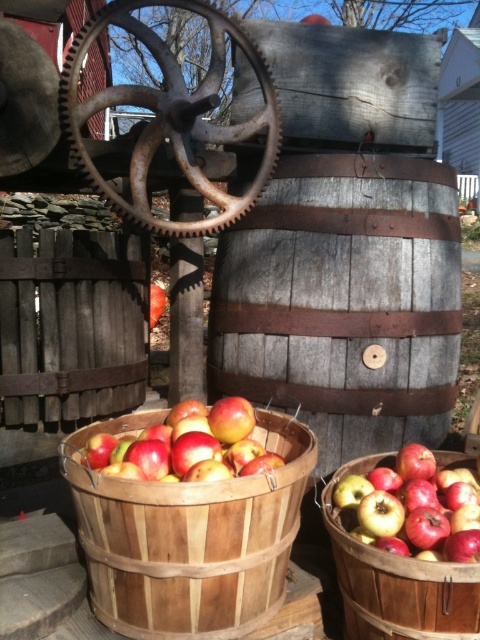
Locate an element on the screen. shiny red apples at lower right is located at coordinates (415, 508).

Who is lower down, shiny red apples at lower right or shiny red apples at center?

shiny red apples at lower right is below.

What do you see at coordinates (415, 508) in the screenshot? This screenshot has height=640, width=480. I see `shiny red apples at lower right` at bounding box center [415, 508].

Find the location of `shiny red apples at lower right`. shiny red apples at lower right is located at coordinates (415, 508).

Is rusty metal gear at center positioned in front of shiny red apples at lower right?

That is False.

This screenshot has width=480, height=640. What do you see at coordinates (169, 115) in the screenshot?
I see `rusty metal gear at center` at bounding box center [169, 115].

Locate an element on the screen. rusty metal gear at center is located at coordinates (169, 115).

Between gray wooden barrel at center and shiny red apples at center, which one appears on the right side from the viewer's perspective?

Positioned to the right is gray wooden barrel at center.

Locate an element on the screen. The image size is (480, 640). gray wooden barrel at center is located at coordinates (344, 300).